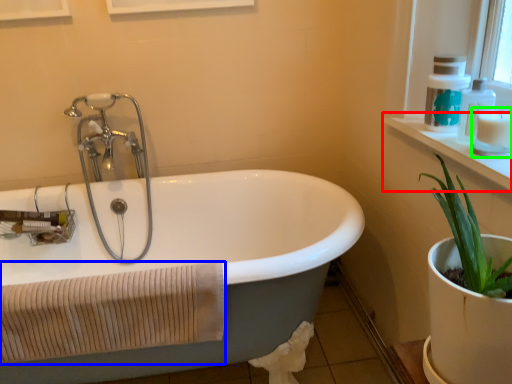
Question: Which is nearer to the window sill (highlighted by a red box)? bath towel (highlighted by a blue box) or toiletry (highlighted by a green box).

Choices:
 (A) bath towel
 (B) toiletry

Answer: (B)